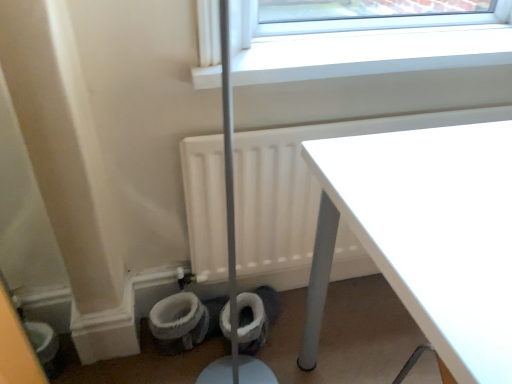
Question: Can you confirm if white plastic window sill at upper center is positioned to the right of white matte radiator at lower left?

Choices:
 (A) yes
 (B) no

Answer: (A)

Question: Considering the relative sizes of white plastic window sill at upper center and white matte radiator at lower left in the image provided, is white plastic window sill at upper center bigger than white matte radiator at lower left?

Choices:
 (A) no
 (B) yes

Answer: (A)

Question: Is white plastic window sill at upper center oriented towards white matte radiator at lower left?

Choices:
 (A) no
 (B) yes

Answer: (A)

Question: Considering the relative positions of white plastic window sill at upper center and white matte radiator at lower left in the image provided, is white plastic window sill at upper center behind white matte radiator at lower left?

Choices:
 (A) yes
 (B) no

Answer: (B)

Question: From the image's perspective, is white plastic window sill at upper center under white matte radiator at lower left?

Choices:
 (A) no
 (B) yes

Answer: (A)

Question: From the image's perspective, relative to white matte radiator at lower left, is white fabric toilet bowl at lower left above or below?

Choices:
 (A) above
 (B) below

Answer: (B)

Question: From a real-world perspective, relative to white matte radiator at lower left, is white fabric toilet bowl at lower left vertically above or below?

Choices:
 (A) below
 (B) above

Answer: (A)

Question: Considering the positions of point (181, 301) and point (194, 152), is point (181, 301) closer or farther from the camera than point (194, 152)?

Choices:
 (A) farther
 (B) closer

Answer: (A)

Question: Is white fabric toilet bowl at lower left in front of or behind white matte radiator at lower left in the image?

Choices:
 (A) behind
 (B) front

Answer: (A)

Question: Is point (223, 324) closer or farther from the camera than point (464, 56)?

Choices:
 (A) farther
 (B) closer

Answer: (B)

Question: Would you say white fluffy toilet paper at lower center is inside or outside white plastic window sill at upper center?

Choices:
 (A) inside
 (B) outside

Answer: (B)

Question: In terms of height, does white fluffy toilet paper at lower center look taller or shorter compared to white plastic window sill at upper center?

Choices:
 (A) short
 (B) tall

Answer: (B)

Question: From a real-world perspective, is white fluffy toilet paper at lower center above or below white plastic window sill at upper center?

Choices:
 (A) below
 (B) above

Answer: (A)

Question: From the image's perspective, is white glossy table at upper right positioned above or below white plastic window sill at upper center?

Choices:
 (A) below
 (B) above

Answer: (A)

Question: In terms of height, does white glossy table at upper right look taller or shorter compared to white plastic window sill at upper center?

Choices:
 (A) tall
 (B) short

Answer: (A)